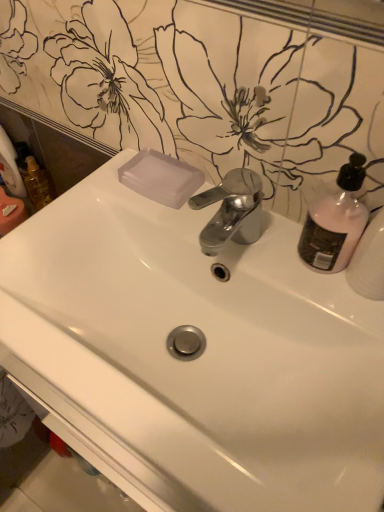
Locate an element on the screen. vacant area that is in front of translucent plastic soap at upper center is located at coordinates (188, 228).